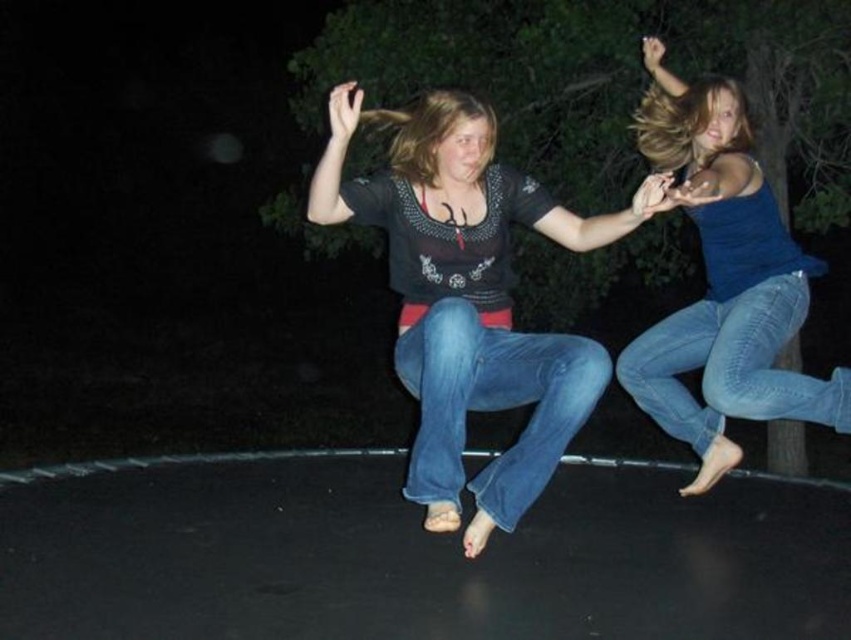
Question: Is blue denim jeans at upper right wider than denim jeans at right?

Choices:
 (A) yes
 (B) no

Answer: (A)

Question: Does blue denim jeans at center appear under denim jeans at right?

Choices:
 (A) yes
 (B) no

Answer: (A)

Question: Which point is closer to the camera?

Choices:
 (A) blue denim jeans at upper right
 (B) denim jeans at right
 (C) matte black shirt at center
 (D) blue denim jeans at center

Answer: (D)

Question: Does matte black shirt at center come behind denim jeans at right?

Choices:
 (A) yes
 (B) no

Answer: (B)

Question: Which point is farther from the camera taking this photo?

Choices:
 (A) (457, 428)
 (B) (781, 419)
 (C) (406, 218)

Answer: (B)

Question: Which point is farther to the camera?

Choices:
 (A) (553, 456)
 (B) (569, 371)

Answer: (A)